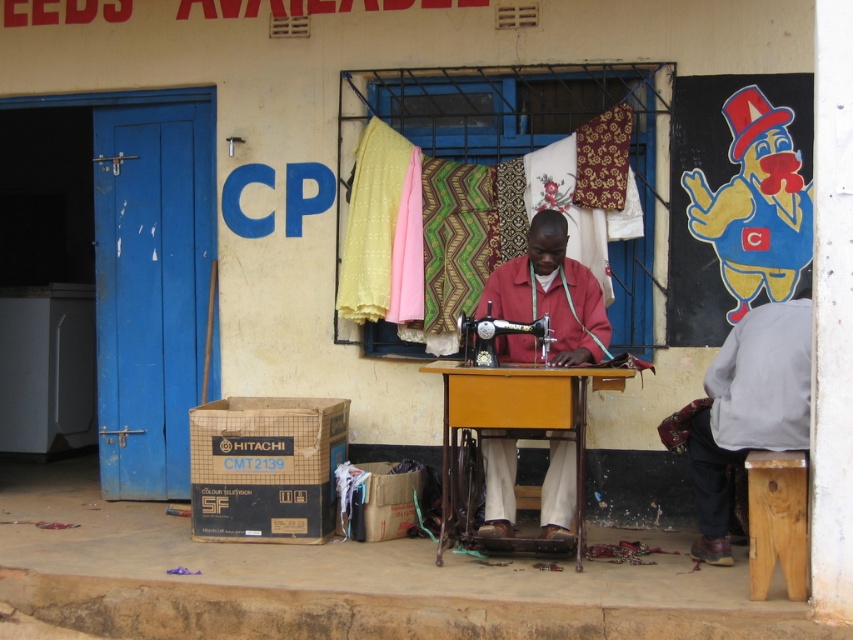
Question: Estimate the real-world distances between objects in this image. Which object is farther from the metallic sewing machine at center?

Choices:
 (A) gray fabric at lower right
 (B) light brown wooden stool at lower right
 (C) brown cardboard box at lower left
 (D) red matte sewing machine at center

Answer: (B)

Question: Where is brown cardboard box at lower left located in relation to red matte sewing machine at center in the image?

Choices:
 (A) left
 (B) right

Answer: (A)

Question: Which point appears farthest from the camera in this image?

Choices:
 (A) (572, 326)
 (B) (322, 490)
 (C) (572, 374)

Answer: (B)

Question: Which point is closer to the camera taking this photo?

Choices:
 (A) (556, 282)
 (B) (786, 509)
 (C) (508, 529)

Answer: (B)

Question: Is gray fabric at lower right to the left of red matte sewing machine at center from the viewer's perspective?

Choices:
 (A) no
 (B) yes

Answer: (A)

Question: In this image, where is brown cardboard box at lower left located relative to light brown wooden stool at lower right?

Choices:
 (A) left
 (B) right

Answer: (A)